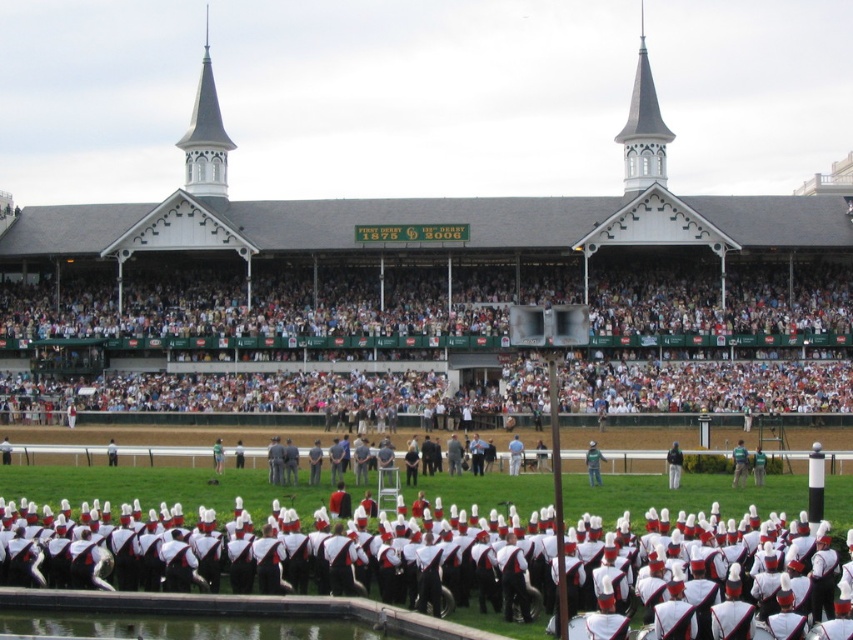
Question: Which point is closer to the camera?

Choices:
 (A) white wood spire at upper center
 (B) white matte uniform at lower center
 (C) white cotton crowd at center
 (D) green fabric jacket at center

Answer: (B)

Question: Which object appears farthest from the camera in this image?

Choices:
 (A) white wood spire at upper center
 (B) green fabric jacket at center
 (C) white matte uniform at lower center

Answer: (A)

Question: Does white wood spire at upper center have a lesser width compared to light blue fabric jacket at center?

Choices:
 (A) yes
 (B) no

Answer: (B)

Question: Considering the relative positions of light blue fabric jacket at center and black leather jacket at center in the image provided, where is light blue fabric jacket at center located with respect to black leather jacket at center?

Choices:
 (A) left
 (B) right

Answer: (A)

Question: Which of these objects is positioned farthest from the black leather jacket at center?

Choices:
 (A) white wood spire at upper center
 (B) green fabric jacket at center
 (C) white cotton crowd at center

Answer: (A)

Question: Can you confirm if green fabric jacket at center is smaller than light blue fabric jacket at center?

Choices:
 (A) yes
 (B) no

Answer: (A)